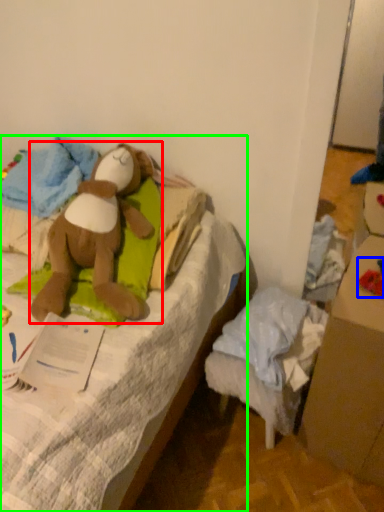
Question: Estimate the real-world distances between objects in this image. Which object is farther from toy (highlighted by a red box), toy (highlighted by a blue box) or furniture (highlighted by a green box)?

Choices:
 (A) toy
 (B) furniture

Answer: (A)